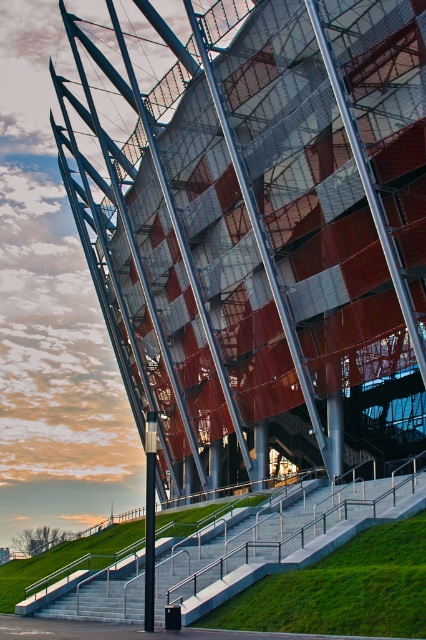
Does metallic red and gray stadium at center appear under concrete stairs at lower left?

Incorrect, metallic red and gray stadium at center is not positioned below concrete stairs at lower left.

Which is in front, point (301, 163) or point (376, 524)?

Point (376, 524)

Describe the element at coordinates (256, 227) in the screenshot. I see `metallic red and gray stadium at center` at that location.

What are the coordinates of `metallic red and gray stadium at center` in the screenshot? It's located at (256, 227).